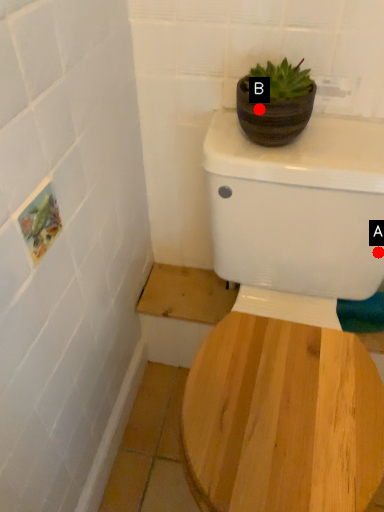
Question: Two points are circled on the image, labeled by A and B beside each circle. Among these points, which one is farthest from the camera?

Choices:
 (A) A is further
 (B) B is further

Answer: (A)